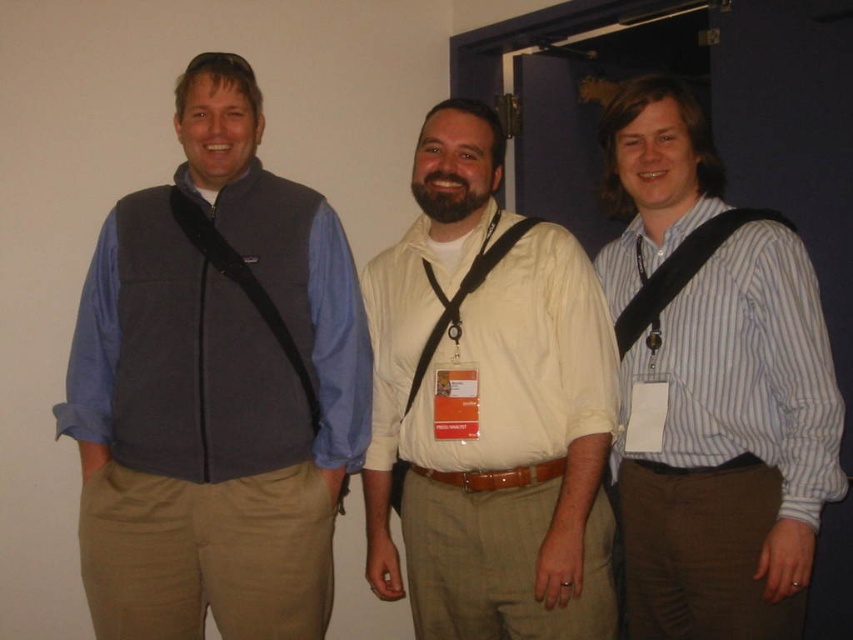
Question: Estimate the real-world distances between objects in this image. Which object is farther from the matte blue vest at left?

Choices:
 (A) black fabric strap at right
 (B) white striped shirt at right
 (C) black fleece strap at left
 (D) light beige shirt at center

Answer: (A)

Question: Estimate the real-world distances between objects in this image. Which object is farther from the white striped shirt at right?

Choices:
 (A) black fleece strap at left
 (B) matte blue vest at left
 (C) black fabric strap at right

Answer: (A)

Question: Can you confirm if matte blue vest at left is positioned to the right of black fabric strap at right?

Choices:
 (A) yes
 (B) no

Answer: (B)

Question: Which object is the closest to the matte blue vest at left?

Choices:
 (A) black fleece strap at left
 (B) light beige shirt at center

Answer: (A)

Question: Does light beige shirt at center have a greater width compared to black fleece strap at left?

Choices:
 (A) no
 (B) yes

Answer: (B)

Question: Can you confirm if white striped shirt at right is smaller than black fleece strap at left?

Choices:
 (A) yes
 (B) no

Answer: (B)